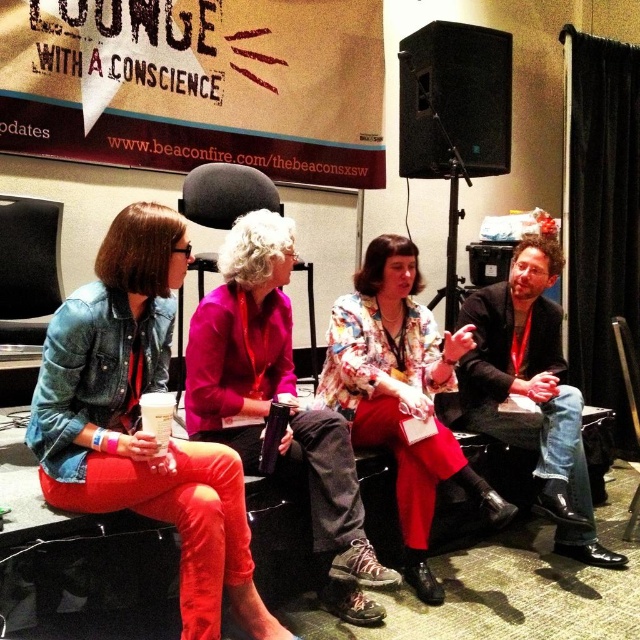
Question: Which of the following is the farthest from the observer?

Choices:
 (A) black leather chair at lower right
 (B) denim jacket at left

Answer: (A)

Question: Does pink fabric shirt at center have a larger size compared to floral fabric blouse at center?

Choices:
 (A) yes
 (B) no

Answer: (A)

Question: From the image, what is the correct spatial relationship of denim jacket at left in relation to black leather chair at center?

Choices:
 (A) above
 (B) below

Answer: (B)

Question: Which of the following is the closest to the observer?

Choices:
 (A) floral fabric blouse at center
 (B) black leather chair at center
 (C) black leather chair at lower right
 (D) denim jacket at left

Answer: (D)

Question: Which is nearer to the denim jacket at left?

Choices:
 (A) pink fabric shirt at center
 (B) jeans at right

Answer: (A)

Question: Is floral fabric blouse at center closer to camera compared to jeans at right?

Choices:
 (A) no
 (B) yes

Answer: (B)